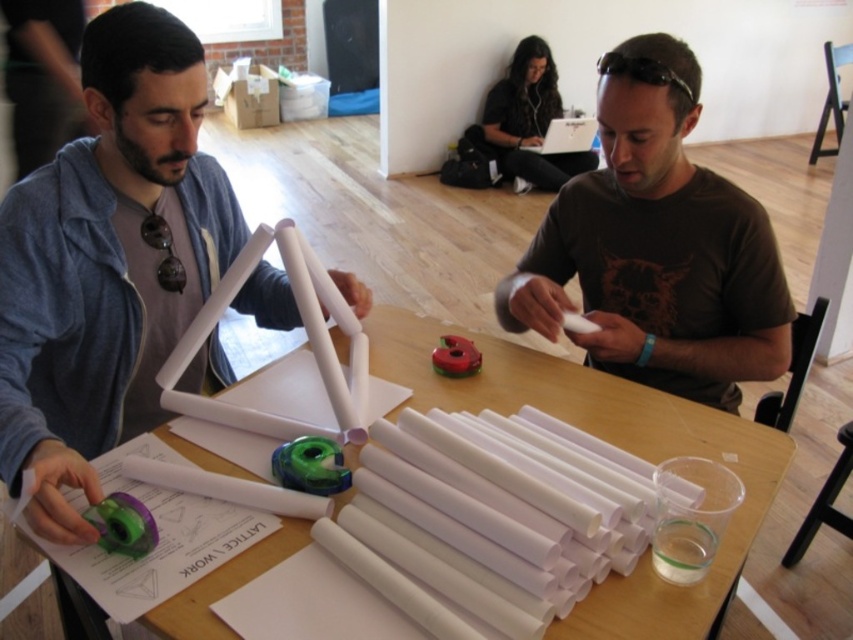
You are standing in the workshop and want to reach the point marked as point (686, 221). If your arm can extend 4 feet, can you reach it without moving?

The point (686, 221) is 4.89 feet away from the viewer. Since your arm can only extend 4 feet, you cannot reach it without moving closer.

Based on the photo, you are an observer standing in front of the table where the two men are working. You notice the brown matte shirt at center and the white paper at center. Which object is positioned higher relative to the other?

The brown matte shirt at center is above the white paper at center, so it is positioned higher.

You are standing in the workshop and want to pick up an object from the table. You notice two points marked on the table surface. Which point, point 1 at coordinates [701,269] or point 2 at [508,360], is closer to you?

Point 1 at coordinates [701,269] is closer to you than point 2 at [508,360] because it is closer to the camera in the image.